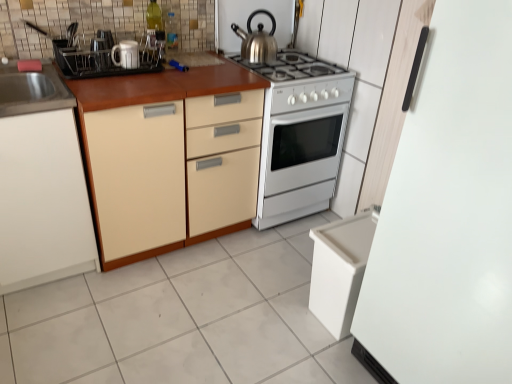
The width and height of the screenshot is (512, 384). What do you see at coordinates (182, 319) in the screenshot?
I see `white glossy tile at lower center` at bounding box center [182, 319].

Where is `white glossy tile at lower center`? Image resolution: width=512 pixels, height=384 pixels. white glossy tile at lower center is located at coordinates (182, 319).

This screenshot has width=512, height=384. What do you see at coordinates (170, 32) in the screenshot? I see `transparent plastic bottle at upper center` at bounding box center [170, 32].

Locate an element on the screen. transparent plastic bottle at upper center is located at coordinates (170, 32).

The image size is (512, 384). What are the coordinates of `white glossy oven at center, placed as the third appliance when sorted from left to right` in the screenshot? It's located at (300, 135).

Describe the element at coordinates (173, 170) in the screenshot. The width and height of the screenshot is (512, 384). I see `matte cream cabinet at center, which appears as the second cabinetry when viewed from the left` at that location.

Where is `matte cream cabinet at center, the 1th cabinetry positioned from the right`? This screenshot has height=384, width=512. matte cream cabinet at center, the 1th cabinetry positioned from the right is located at coordinates (173, 170).

Locate an element on the screen. The image size is (512, 384). white glossy tile at lower center is located at coordinates (182, 319).

Can you confirm if transparent plastic bottle at upper center is smaller than white glossy mug at upper left, which is the 3th appliance in front-to-back order?

Yes.

From a real-world perspective, who is located higher, transparent plastic bottle at upper center or white glossy mug at upper left, marked as the 2th appliance in a back-to-front arrangement?

transparent plastic bottle at upper center is physically above.

Where is `appliance that is the 2nd object directly below the transparent plastic bottle at upper center (from a real-world perspective)`? This screenshot has width=512, height=384. appliance that is the 2nd object directly below the transparent plastic bottle at upper center (from a real-world perspective) is located at coordinates (126, 54).

Is the position of transparent plastic bottle at upper center less distant than that of white glossy mug at upper left, marked as the 2th appliance in a back-to-front arrangement?

No, transparent plastic bottle at upper center is further to the viewer.

Which of these two, white glossy mug at upper left, which is the 3th appliance from right to left, or white glossy gas stove at center, stands taller?

white glossy gas stove at center is taller.

Based on the photo, is white glossy mug at upper left, which is the 3th appliance from right to left, surrounding white glossy gas stove at center?

No, white glossy gas stove at center is not inside white glossy mug at upper left, which is the 3th appliance from right to left.

Considering their positions, is white glossy mug at upper left, the 2th appliance viewed from the left, located in front of or behind white glossy gas stove at center?

In the image, white glossy mug at upper left, the 2th appliance viewed from the left, appears in front of white glossy gas stove at center.

Does white glossy refrigerator at right, the 1th appliance in the right-to-left sequence, have a larger size compared to matte cream cabinet at center, the 1th cabinetry positioned from the right?

Yes.

Between white glossy refrigerator at right, which ranks as the fourth appliance in left-to-right order, and matte cream cabinet at center, which appears as the second cabinetry when viewed from the left, which one appears on the right side from the viewer's perspective?

Positioned to the right is white glossy refrigerator at right, which ranks as the fourth appliance in left-to-right order.

From a real-world perspective, is white glossy refrigerator at right, the 1th appliance in the right-to-left sequence, under matte cream cabinet at center, the 1th cabinetry positioned from the right?

Actually, white glossy refrigerator at right, the 1th appliance in the right-to-left sequence, is physically above matte cream cabinet at center, the 1th cabinetry positioned from the right, in the real world.

Is polished stainless steel kettle at upper center facing away from white glossy gas stove at center?

No, polished stainless steel kettle at upper center's orientation is not away from white glossy gas stove at center.

The image size is (512, 384). In order to click on gas stove located on the right of polished stainless steel kettle at upper center in this screenshot , I will do `click(303, 81)`.

From a real-world perspective, does polished stainless steel kettle at upper center stand above white glossy gas stove at center?

Yes, from a real-world perspective, polished stainless steel kettle at upper center is on top of white glossy gas stove at center.

From the image's perspective, which object appears higher, polished stainless steel kettle at upper center or white glossy gas stove at center?

polished stainless steel kettle at upper center is shown above in the image.

From the image's perspective, which is below, polished stainless steel kettle at upper center or stainless steel sink at left?

stainless steel sink at left.

Is polished stainless steel kettle at upper center oriented towards stainless steel sink at left?

No, polished stainless steel kettle at upper center is not facing towards stainless steel sink at left.

How many degrees apart are the facing directions of polished stainless steel kettle at upper center and stainless steel sink at left?

The facing directions of polished stainless steel kettle at upper center and stainless steel sink at left are 1.07 degrees apart.

From the picture: Is polished stainless steel kettle at upper center surrounding stainless steel sink at left?

No, stainless steel sink at left is located outside of polished stainless steel kettle at upper center.

Which cabinetry is the 1st one when counting from the front of the white glossy mug at upper left, which is the 3th appliance in front-to-back order? Please provide its 2D coordinates.

[(173, 170)]

Does white glossy mug at upper left, which is the 3th appliance from right to left, come behind matte cream cabinet at center, which appears as the second cabinetry when viewed from the left?

Yes, white glossy mug at upper left, which is the 3th appliance from right to left, is further from the camera.

Is white glossy mug at upper left, marked as the 2th appliance in a back-to-front arrangement, to the right of matte cream cabinet at center, the 1th cabinetry positioned from the right, from the viewer's perspective?

Incorrect, white glossy mug at upper left, marked as the 2th appliance in a back-to-front arrangement, is not on the right side of matte cream cabinet at center, the 1th cabinetry positioned from the right.

Does white glossy tile at lower center have a smaller size compared to white glossy oven at center, which is the 1th appliance from back to front?

Yes.

Considering the relative sizes of white glossy tile at lower center and white glossy oven at center, marked as the second appliance in a right-to-left arrangement, in the image provided, is white glossy tile at lower center taller than white glossy oven at center, marked as the second appliance in a right-to-left arrangement,?

No.

Looking at their sizes, would you say white glossy tile at lower center is wider or thinner than white glossy oven at center, placed as the third appliance when sorted from left to right?

Clearly, white glossy tile at lower center has more width compared to white glossy oven at center, placed as the third appliance when sorted from left to right.

Can you see white glossy tile at lower center touching white glossy oven at center, which ranks as the 4th appliance in front-to-back order?

white glossy tile at lower center and white glossy oven at center, which ranks as the 4th appliance in front-to-back order, are not in contact.

The height and width of the screenshot is (384, 512). Find the location of `bottle that is behind the white glossy mug at upper left, which is the 3th appliance from right to left`. bottle that is behind the white glossy mug at upper left, which is the 3th appliance from right to left is located at coordinates (170, 32).

Image resolution: width=512 pixels, height=384 pixels. Find the location of `the 1st appliance above the white glossy gas stove at center (from a real-world perspective)`. the 1st appliance above the white glossy gas stove at center (from a real-world perspective) is located at coordinates (126, 54).

Which object lies nearer to the anchor point white glossy tile at lower center, white glossy gas stove at center or matte white mug at upper left, acting as the fourth appliance starting from the right?

white glossy gas stove at center is positioned closer to the anchor white glossy tile at lower center.

From the picture: Considering their positions, is white glossy gas stove at center positioned further to transparent plastic bottle at upper center than white glossy mug at upper left, which is the 3th appliance from right to left?

The object further to transparent plastic bottle at upper center is white glossy gas stove at center.

In the scene shown: Based on their spatial positions, is white glossy oven at center, which ranks as the 4th appliance in front-to-back order, or white glossy refrigerator at right, the 1th appliance in the right-to-left sequence, closer to matte cream cabinet at center, which appears as the second cabinetry when viewed from the left?

white glossy oven at center, which ranks as the 4th appliance in front-to-back order.

Consider the image. Considering their positions, is polished stainless steel kettle at upper center positioned closer to white glossy refrigerator at right, which ranks as the fourth appliance in left-to-right order, than white glossy tile at lower center?

white glossy tile at lower center is closer to white glossy refrigerator at right, which ranks as the fourth appliance in left-to-right order.

Based on their spatial positions, is white glossy tile at lower center or white plastic dishwasher at lower right closer to white glossy gas stove at center?

white plastic dishwasher at lower right lies closer to white glossy gas stove at center than the other object.

Considering their positions, is matte white mug at upper left, which ranks as the 1th appliance in left-to-right order, positioned closer to white glossy tile at lower center than matte cream cabinet at center, the 1th cabinetry positioned from the right?

matte cream cabinet at center, the 1th cabinetry positioned from the right.

Estimate the real-world distances between objects in this image. Which object is closer to white glossy tile at lower center, transparent plastic bottle at upper center or white glossy refrigerator at right, the 1th appliance in the right-to-left sequence?

Among the two, white glossy refrigerator at right, the 1th appliance in the right-to-left sequence, is located nearer to white glossy tile at lower center.

From the image, which object appears to be farther from polished stainless steel kettle at upper center, white plastic dishwasher at lower right or white matte cabinet at left, which appears as the second cabinetry when viewed from the right?

white matte cabinet at left, which appears as the second cabinetry when viewed from the right, is positioned further to the anchor polished stainless steel kettle at upper center.

Find the location of a particular element. The image size is (512, 384). cabinetry between white matte cabinet at left, the first cabinetry from the left, and white plastic dishwasher at lower right, in the horizontal direction is located at coordinates (173, 170).

You are a GUI agent. You are given a task and a screenshot of the screen. Output one action in this format:
    pyautogui.click(x=<x>, y=<y>)
    Task: Click on the sink between white glossy mug at upper left, which is the 3th appliance from right to left, and white glossy tile at lower center vertically
    
    Given the screenshot: What is the action you would take?
    pyautogui.click(x=32, y=90)

Image resolution: width=512 pixels, height=384 pixels. Find the location of `kitchen appliance situated between white glossy mug at upper left, the 2th appliance viewed from the left, and white glossy oven at center, placed as the third appliance when sorted from left to right, from left to right`. kitchen appliance situated between white glossy mug at upper left, the 2th appliance viewed from the left, and white glossy oven at center, placed as the third appliance when sorted from left to right, from left to right is located at coordinates (257, 40).

Locate an element on the screen. The image size is (512, 384). bottle between stainless steel sink at left and white glossy refrigerator at right, which ranks as the fourth appliance in left-to-right order, from left to right is located at coordinates (170, 32).